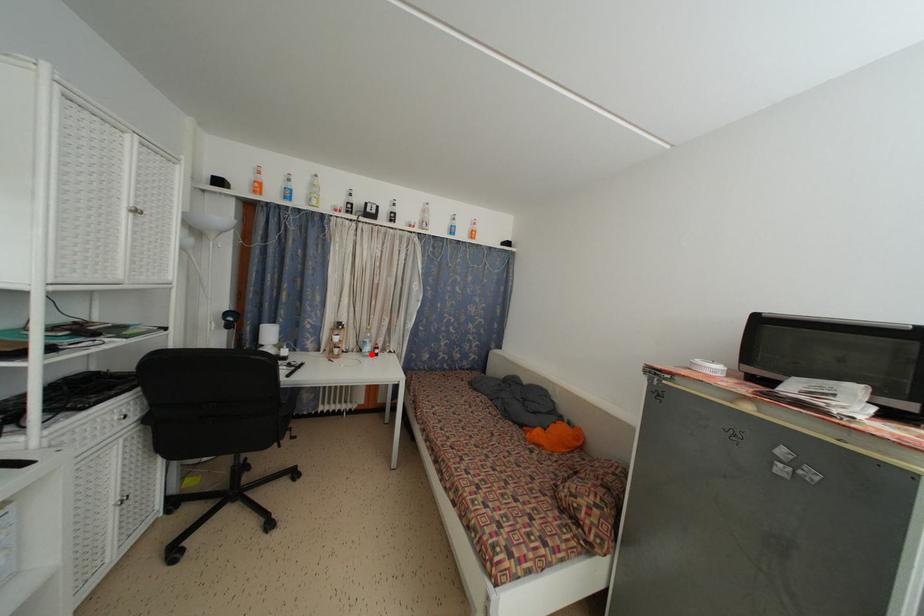
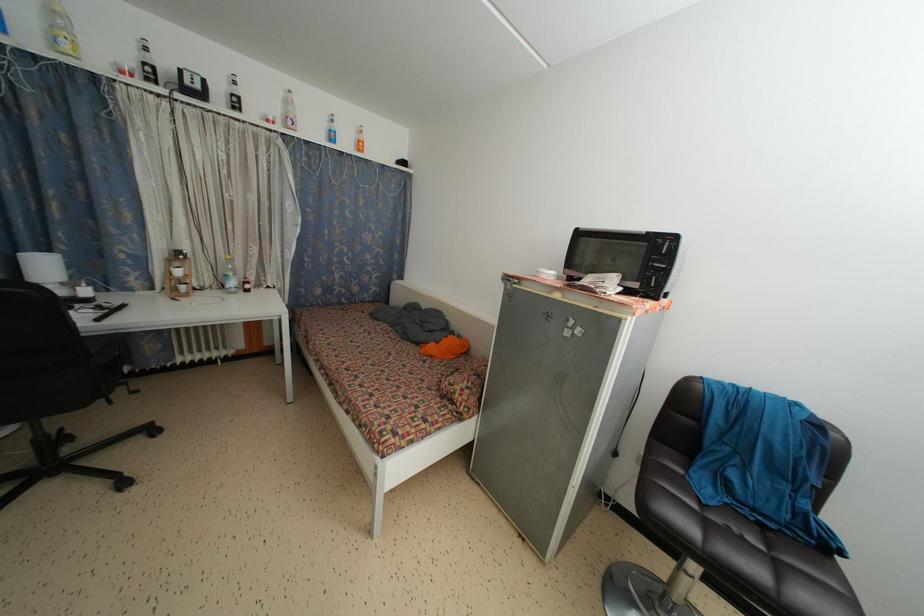
Find the pixel in the second image that matches the highlighted location in the first image.

(237, 289)